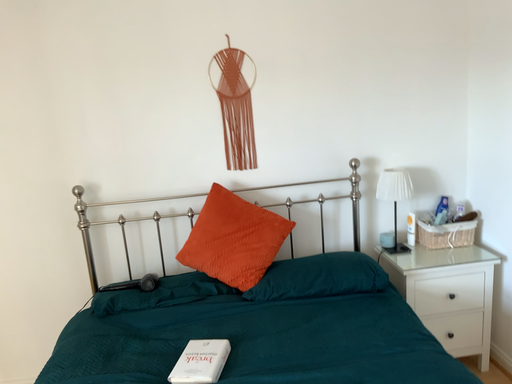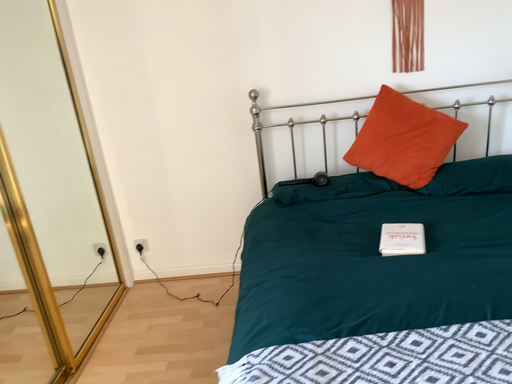
Question: Which way did the camera rotate in the video?

Choices:
 (A) rotated downward
 (B) rotated upward

Answer: (A)